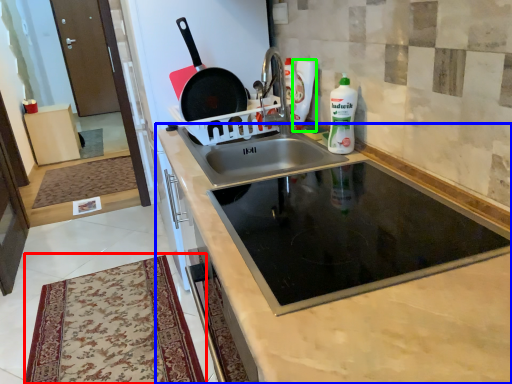
Question: Which object is positioned farthest from mat (highlighted by a red box)? Select from cabinetry (highlighted by a blue box) and cleaning product (highlighted by a green box).

Choices:
 (A) cabinetry
 (B) cleaning product

Answer: (B)